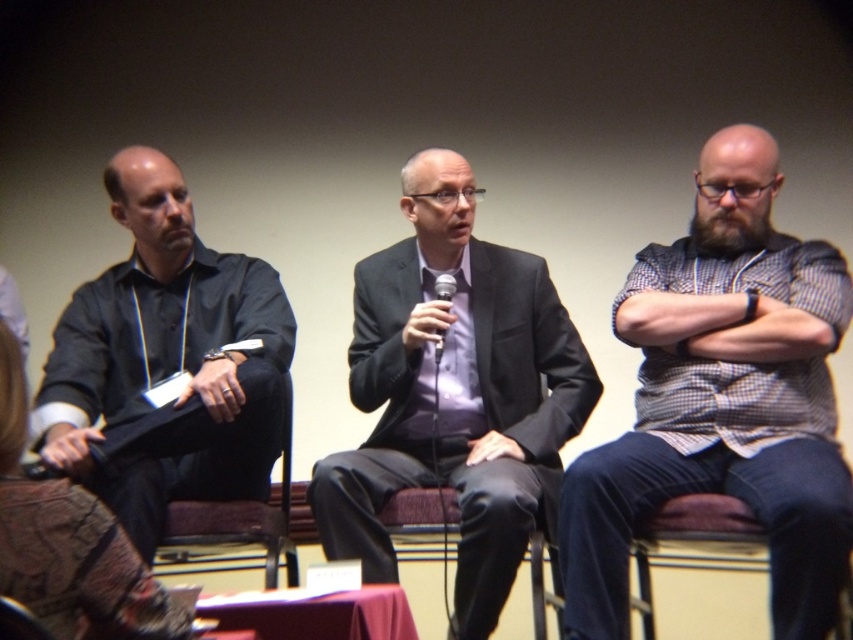
Question: Does matte black suit at center appear on the right side of black plastic microphone at center?

Choices:
 (A) yes
 (B) no

Answer: (A)

Question: Can you confirm if brown fabric chair at lower left is thinner than black plastic microphone at center?

Choices:
 (A) yes
 (B) no

Answer: (B)

Question: Which object appears closest to the camera in this image?

Choices:
 (A) black matte shirt at left
 (B) black plastic microphone at center
 (C) brown fabric chair at lower left
 (D) checkered shirt at right

Answer: (D)

Question: Which of the following is the closest to the observer?

Choices:
 (A) checkered shirt at right
 (B) black matte shirt at left

Answer: (A)

Question: Does brown fabric chair at lower left appear on the left side of black plastic microphone at center?

Choices:
 (A) yes
 (B) no

Answer: (A)

Question: Estimate the real-world distances between objects in this image. Which object is farther from the checkered shirt at right?

Choices:
 (A) brown fabric chair at lower left
 (B) black plastic microphone at center

Answer: (A)